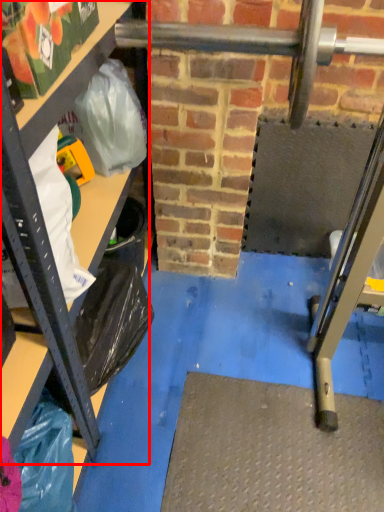
Question: Considering the relative positions of shelf (annotated by the red box) and grocery bag in the image provided, where is shelf (annotated by the red box) located with respect to the staircase?

Choices:
 (A) left
 (B) right

Answer: (A)